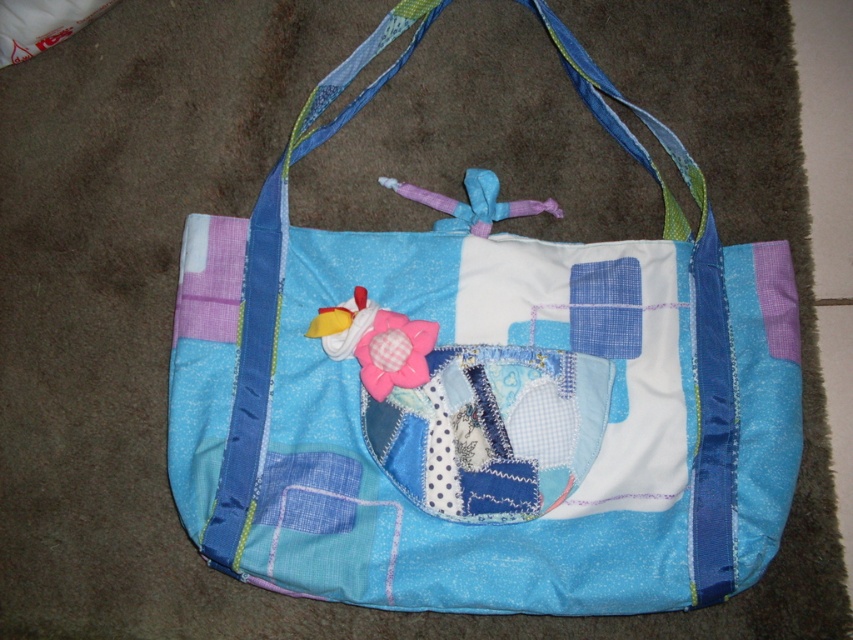
You are looking at the handmade fabric bag on the carpet. There are two points marked on the bag. The first point is at coordinates point [669,141] and the second is at point [474,369]. Which point is closer to you?

Point [669,141] is further to the camera than point [474,369], so the point closer to you is point [474,369].

You are standing in front of a handmade fabric bag on a brown carpet. The bag has a patchwork design with blue, white, and purple fabrics. There is a pink flower with a yellow center, a small white bird with red accents, and a polka dotted fabric piece on its front. A point at coordinates (485,397) is marked. Which object does this point correspond to?

The point at coordinates (485,397) corresponds to the patchwork fabric shoulder bag at center.

You are organizing a craft fair and need to know the arrangement of items on the handmade fabric bag. Which object is positioned higher on the bag, the patchwork fabric shoulder bag at center or the patchwork fabric pocket at center?

The patchwork fabric shoulder bag at center is above the patchwork fabric pocket at center, so the patchwork fabric shoulder bag at center is positioned higher.